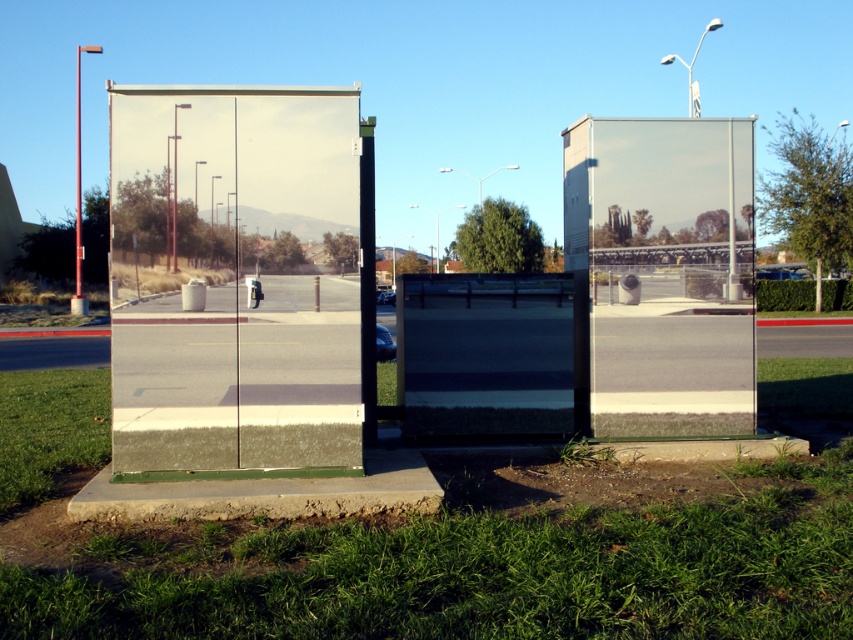
You are a delivery person who needs to place a 1.8 meter tall package between the metallic reflective bus stop at left and the transparent glass phone box at center. Considering their heights, which object should the package be placed closer to?

The metallic reflective bus stop at left has a greater height compared to the transparent glass phone box at center. Therefore, the 1.8 meter tall package should be placed closer to the metallic reflective bus stop at left to maintain proportional height alignment.

Based on the photo, you are a gardener who needs to mow the lawn around the structure. The mower you have is 1.2 meters wide. Can you safely maneuver between the green grass at lower center and the concrete base without damaging the mower or the structure?

The distance between the green grass at lower center and the concrete base is 3.58 meters. Since the mower is only 1.2 meters wide, there is sufficient space to maneuver safely between them. The 3.58 meter gap is more than twice the mower width, allowing for easy passage without any risk of collision.

You are a delivery person who needs to park your van near the metallic reflective bus stop at left and the transparent glass phone box at center. Since the road is narrow, you need to know which object is closer to the road to park safely. Can you determine which one is closer to the road?

The metallic reflective bus stop at left is positioned on the left side of the transparent glass phone box at center, so it is closer to the road than the transparent glass phone box at center. Therefore, park near the metallic reflective bus stop at left for safer access.